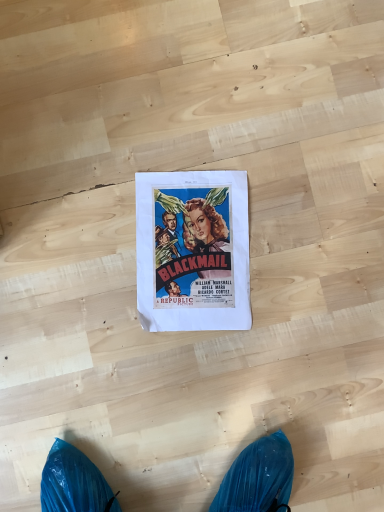
The height and width of the screenshot is (512, 384). What do you see at coordinates (193, 251) in the screenshot? I see `matte paper poster at center` at bounding box center [193, 251].

This screenshot has width=384, height=512. I want to click on matte paper poster at center, so click(193, 251).

This screenshot has width=384, height=512. I want to click on matte paper poster at center, so click(193, 251).